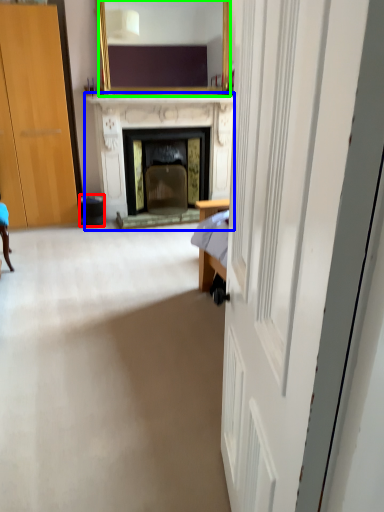
Question: Considering the real-world distances, which object is farthest from trash bin/can (highlighted by a red box)? fireplace (highlighted by a blue box) or mirror (highlighted by a green box)?

Choices:
 (A) fireplace
 (B) mirror

Answer: (B)